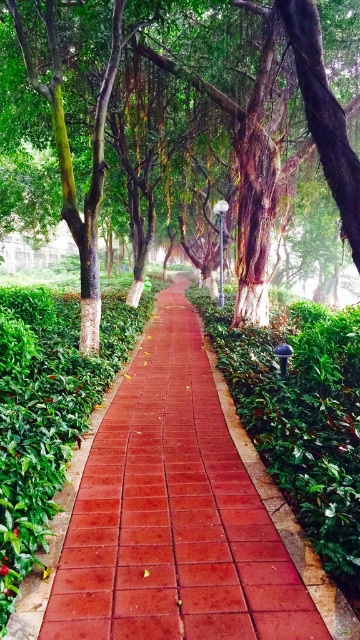
You are a gardener planning to install a new fence along the pathway. The fence needs to be as tall as the red brick path at center. Will the fence be shorter than the green matte tree at center?

Yes, the red brick path at center is shorter than the green matte tree at center, so the fence, being the same height as the path, will also be shorter than the tree.

You are a gardener who needs to water both the red brick path at center and the green matte tree at center. If your watering can holds 2 liters of water, and each requires 1 liter, can you water both without refilling?

The red brick path at center and green matte tree at center are 5.54 feet apart from each other. Since your watering can holds 2 liters and each requires 1 liter, you can water both without needing to refill.

You are standing at the start of the pathway and want to take a photo of the red brick path at center and the green matte tree at center. Which object will appear larger in your photo?

The red brick path at center will appear larger in the photo because it is closer to the viewer than the green matte tree at center.